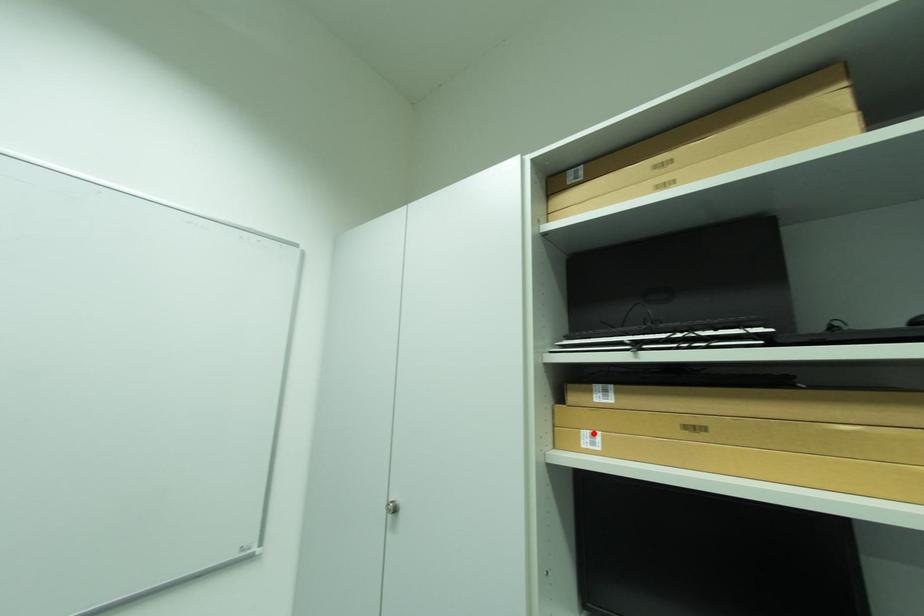
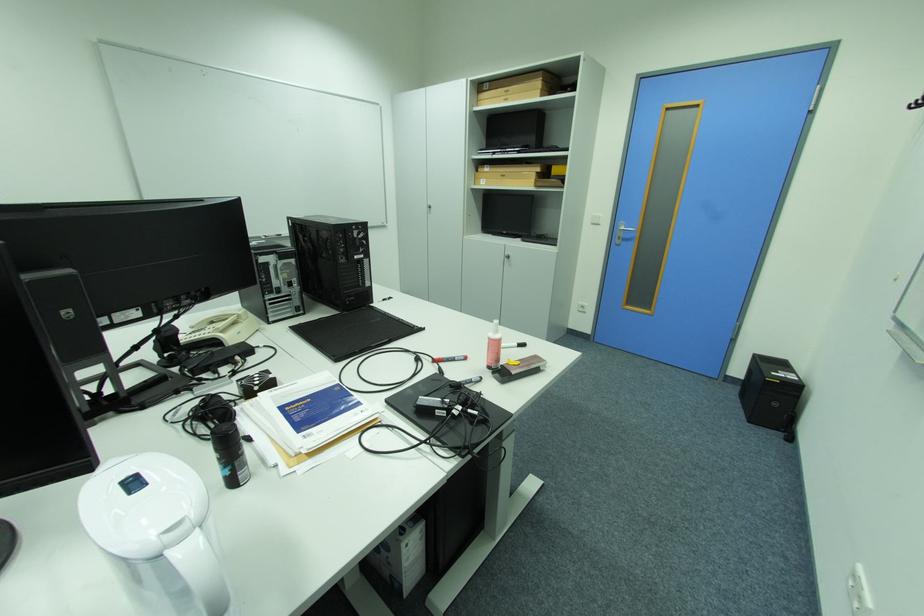
The point at the highlighted location is marked in the first image. Where is the corresponding point in the second image?

(490, 180)